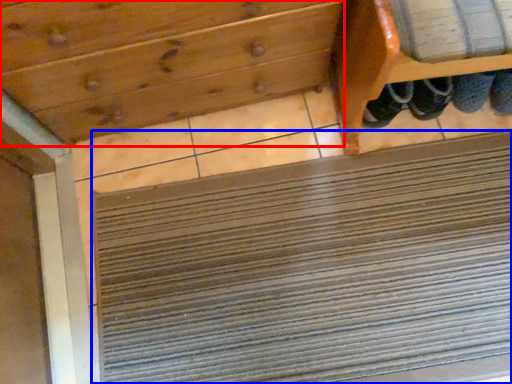
Question: Which object appears farthest to the camera in this image, drawer (highlighted by a red box) or doormat (highlighted by a blue box)?

Choices:
 (A) drawer
 (B) doormat

Answer: (B)